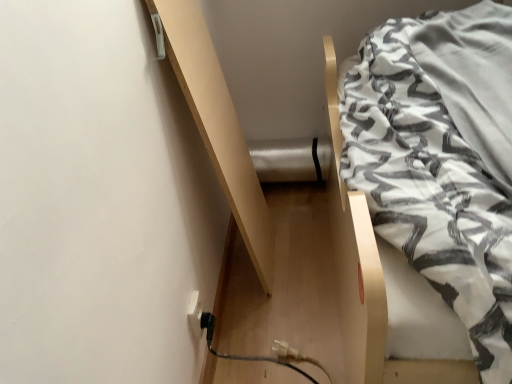
Question: Is white plastic electric outlet at lower left closer to camera compared to white textured fabric at upper right?

Choices:
 (A) yes
 (B) no

Answer: (B)

Question: Is white plastic electric outlet at lower left positioned behind white textured fabric at upper right?

Choices:
 (A) yes
 (B) no

Answer: (A)

Question: Is white plastic electric outlet at lower left facing away from white textured fabric at upper right?

Choices:
 (A) yes
 (B) no

Answer: (B)

Question: Does white plastic electric outlet at lower left have a lesser width compared to white textured fabric at upper right?

Choices:
 (A) yes
 (B) no

Answer: (A)

Question: From the image's perspective, is white plastic electric outlet at lower left located beneath white textured fabric at upper right?

Choices:
 (A) no
 (B) yes

Answer: (B)

Question: Can you confirm if white plastic electric outlet at lower left is bigger than white textured fabric at upper right?

Choices:
 (A) yes
 (B) no

Answer: (B)

Question: Is light wood shelf at upper left positioned beyond the bounds of white plastic electric outlet at lower left?

Choices:
 (A) yes
 (B) no

Answer: (A)

Question: Is light wood shelf at upper left smaller than white plastic electric outlet at lower left?

Choices:
 (A) no
 (B) yes

Answer: (A)

Question: From the image's perspective, is light wood shelf at upper left located above white plastic electric outlet at lower left?

Choices:
 (A) no
 (B) yes

Answer: (B)

Question: Is light wood shelf at upper left at the right side of white plastic electric outlet at lower left?

Choices:
 (A) yes
 (B) no

Answer: (A)

Question: Is light wood shelf at upper left surrounding white plastic electric outlet at lower left?

Choices:
 (A) no
 (B) yes

Answer: (A)

Question: Is light wood shelf at upper left positioned far away from white plastic electric outlet at lower left?

Choices:
 (A) no
 (B) yes

Answer: (A)

Question: Is white textured fabric at upper right at the right side of light wood shelf at upper left?

Choices:
 (A) yes
 (B) no

Answer: (A)